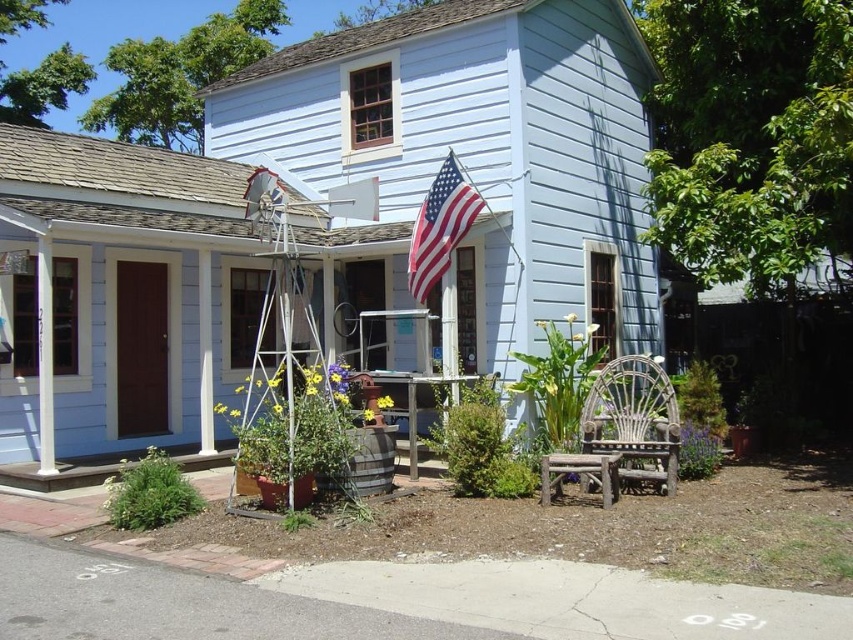
Question: Which is farther from the american flag at upper center?

Choices:
 (A) metallic silver windmill at center
 (B) rustic wood stool at lower center

Answer: (A)

Question: Estimate the real-world distances between objects in this image. Which object is farther from the american flag at upper center?

Choices:
 (A) white wicker chair at lower right
 (B) white painted wood at center

Answer: (B)

Question: Can you confirm if white wicker chair at lower right is positioned to the left of american flag at upper center?

Choices:
 (A) yes
 (B) no

Answer: (B)

Question: Does metallic silver windmill at center appear over american flag at upper center?

Choices:
 (A) no
 (B) yes

Answer: (A)

Question: Which point appears closest to the camera in this image?

Choices:
 (A) (583, 445)
 (B) (200, 352)

Answer: (A)

Question: Does metallic silver windmill at center have a lesser width compared to rustic wood stool at lower center?

Choices:
 (A) yes
 (B) no

Answer: (A)